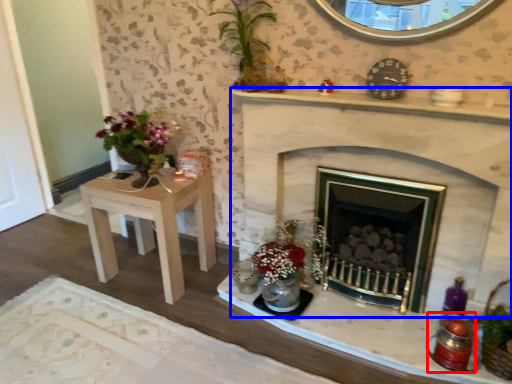
Question: Which object appears farthest to the camera in this image, candle holder (highlighted by a red box) or fireplace (highlighted by a blue box)?

Choices:
 (A) candle holder
 (B) fireplace

Answer: (A)